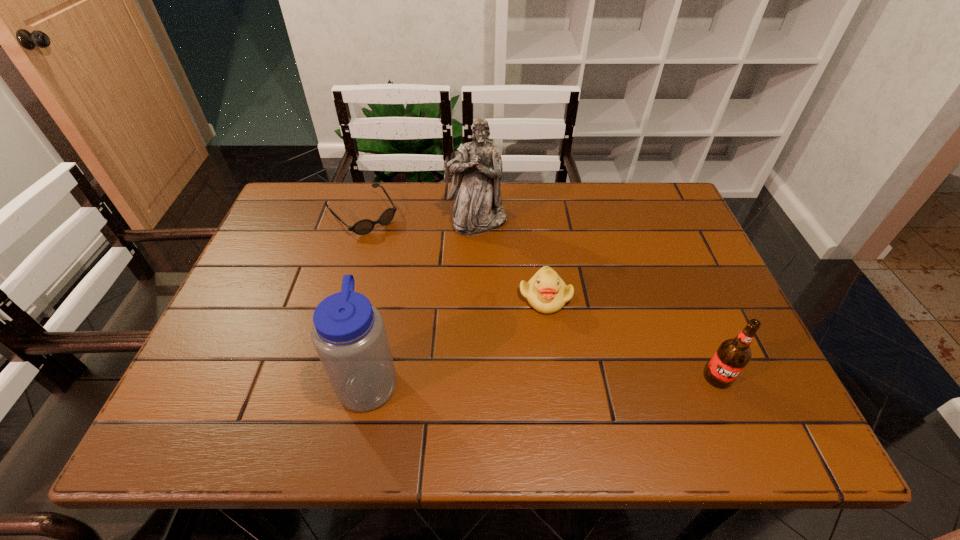
I want to click on free space on the desktop that is between the second tallest object and the third shortest object and is positioned on the front-facing side of the third farthest object, so click(588, 378).

Where is `free space on the desktop that is between the fourth shortest object and the root beer and is positioned on the front-facing side of the figurine`? free space on the desktop that is between the fourth shortest object and the root beer and is positioned on the front-facing side of the figurine is located at coordinates (568, 379).

What are the coordinates of `free space on the desktop that is between the water bottle and the root beer and is positioned on the lenses of the sunglasses` in the screenshot? It's located at (523, 379).